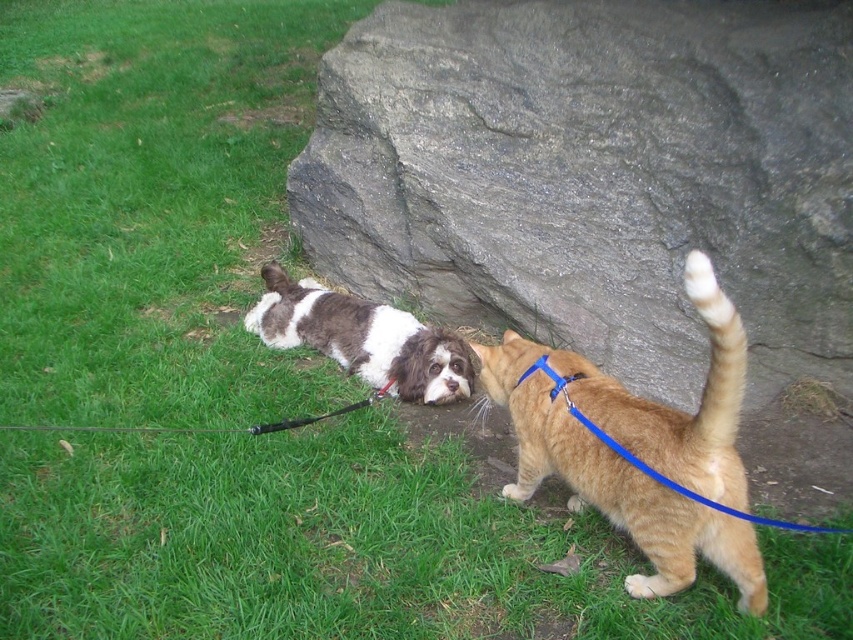
Question: Which point is farther to the camera?

Choices:
 (A) (294, 419)
 (B) (698, 518)

Answer: (A)

Question: Is brown and white fur at center to the right of black rubber leash at lower center from the viewer's perspective?

Choices:
 (A) yes
 (B) no

Answer: (A)

Question: Does orange tabby cat at lower right appear on the left side of black rubber leash at lower center?

Choices:
 (A) yes
 (B) no

Answer: (B)

Question: Which point appears closest to the camera in this image?

Choices:
 (A) (334, 316)
 (B) (688, 566)
 (C) (32, 429)

Answer: (B)

Question: Estimate the real-world distances between objects in this image. Which object is closer to the brown and white fur at center?

Choices:
 (A) black rubber leash at lower center
 (B) orange tabby cat at lower right

Answer: (A)

Question: Can you confirm if orange tabby cat at lower right is smaller than brown and white fur at center?

Choices:
 (A) yes
 (B) no

Answer: (B)